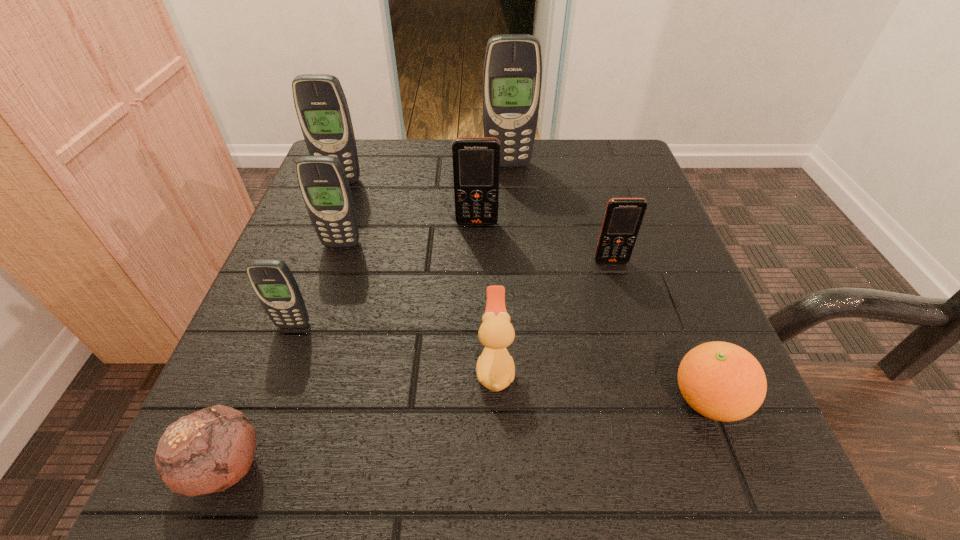
In order to click on empty location between the smaller orange cellular telephone and the duck in this screenshot , I will do `click(553, 314)`.

Find the location of a particular element. unoccupied area between the third farthest object and the orange orange is located at coordinates [592, 312].

I want to click on free space between the orange orange and the fifth shortest cellular telephone, so click(x=524, y=291).

I want to click on unoccupied position between the seventh nearest object and the second tallest object, so click(409, 202).

This screenshot has width=960, height=540. Find the location of `free space between the seventh nearest object and the right orange cellular telephone`. free space between the seventh nearest object and the right orange cellular telephone is located at coordinates (544, 242).

Locate an element on the screen. This screenshot has height=540, width=960. free space between the orange orange and the tan duck is located at coordinates (601, 383).

I want to click on empty location between the rightmost gray cellular telephone and the second tallest object, so click(424, 173).

I want to click on vacant area that lies between the third farthest cellular telephone and the nearest cellular telephone, so click(x=385, y=274).

The width and height of the screenshot is (960, 540). Find the location of `object that is the sixth nearest to the second nearest cellular telephone`. object that is the sixth nearest to the second nearest cellular telephone is located at coordinates (272, 281).

At what (x,y) coordinates should I click in order to perform the action: click on object that is the second closest to the orange. Please return your answer as a coordinate pair (x, y). The width and height of the screenshot is (960, 540). Looking at the image, I should click on (623, 217).